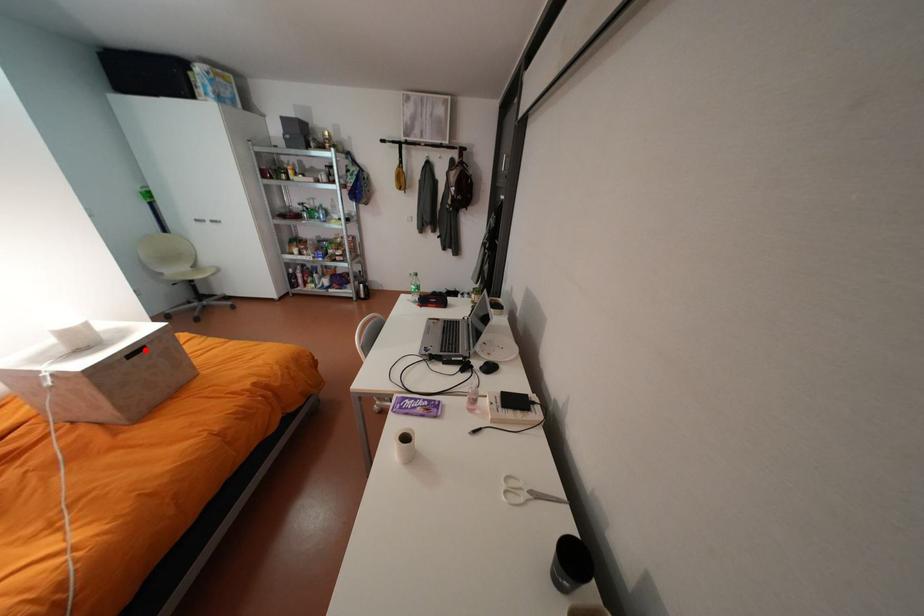
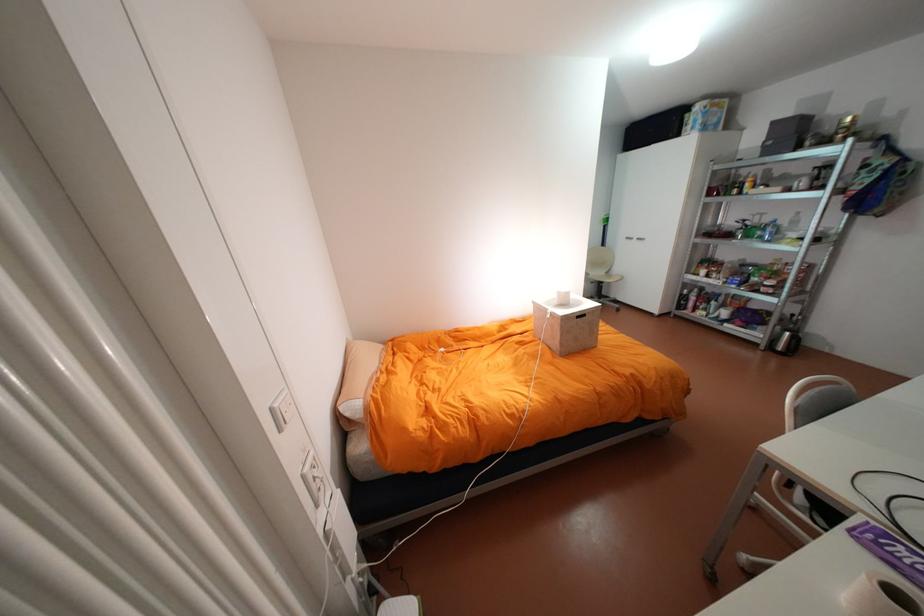
In the second image, find the point that corresponds to the highlighted location in the first image.

(590, 315)